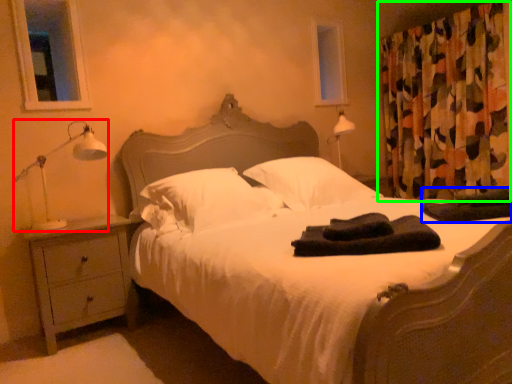
Question: Which is farther away from table lamp (highlighted by a red box)? material (highlighted by a blue box) or curtain (highlighted by a green box)?

Choices:
 (A) material
 (B) curtain

Answer: (B)